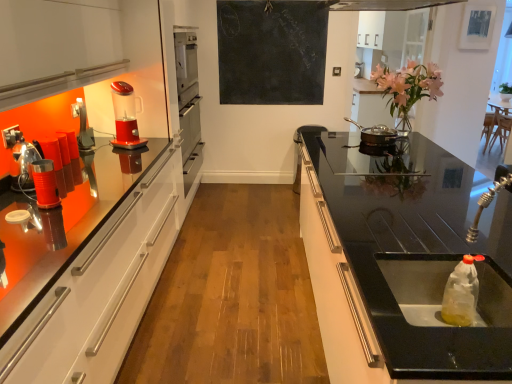
Question: Does black chalkboard at upper center appear on the left side of metallic red canister at left, placed as the first appliance when sorted from front to back?

Choices:
 (A) no
 (B) yes

Answer: (A)

Question: Does black chalkboard at upper center have a smaller size compared to metallic red canister at left, marked as the 2th appliance in a left-to-right arrangement?

Choices:
 (A) yes
 (B) no

Answer: (B)

Question: Does black chalkboard at upper center have a greater height compared to metallic red canister at left, placed as the first appliance when sorted from front to back?

Choices:
 (A) yes
 (B) no

Answer: (A)

Question: Is black chalkboard at upper center touching metallic red canister at left, arranged as the 3th appliance when viewed from the back?

Choices:
 (A) yes
 (B) no

Answer: (B)

Question: Considering the relative sizes of black chalkboard at upper center and metallic red canister at left, which is the 2th appliance in right-to-left order, in the image provided, is black chalkboard at upper center thinner than metallic red canister at left, which is the 2th appliance in right-to-left order,?

Choices:
 (A) yes
 (B) no

Answer: (A)

Question: Considering the relative positions of black chalkboard at upper center and translucent plastic blender at left in the image provided, is black chalkboard at upper center to the left or to the right of translucent plastic blender at left?

Choices:
 (A) right
 (B) left

Answer: (A)

Question: From their relative heights in the image, would you say black chalkboard at upper center is taller or shorter than translucent plastic blender at left?

Choices:
 (A) tall
 (B) short

Answer: (A)

Question: Is black chalkboard at upper center in front of or behind translucent plastic blender at left in the image?

Choices:
 (A) front
 (B) behind

Answer: (B)

Question: From a real-world perspective, is black chalkboard at upper center physically located above or below translucent plastic blender at left?

Choices:
 (A) below
 (B) above

Answer: (B)

Question: Based on their positions, is translucent plastic blender at left located to the left or right of black glass sink at right?

Choices:
 (A) right
 (B) left

Answer: (B)

Question: From the image's perspective, is translucent plastic blender at left located above or below black glass sink at right?

Choices:
 (A) below
 (B) above

Answer: (B)

Question: Considering the positions of translucent plastic blender at left and black glass sink at right in the image, is translucent plastic blender at left taller or shorter than black glass sink at right?

Choices:
 (A) tall
 (B) short

Answer: (B)

Question: Is translucent plastic blender at left inside or outside of black glass sink at right?

Choices:
 (A) inside
 (B) outside

Answer: (B)

Question: Is metallic stainless steel cup at left, marked as the 1th appliance in a left-to-right arrangement, to the left or to the right of translucent plastic blender at left in the image?

Choices:
 (A) left
 (B) right

Answer: (A)

Question: Which is correct: metallic stainless steel cup at left, marked as the 1th appliance in a left-to-right arrangement, is inside translucent plastic blender at left, or outside of it?

Choices:
 (A) inside
 (B) outside

Answer: (B)